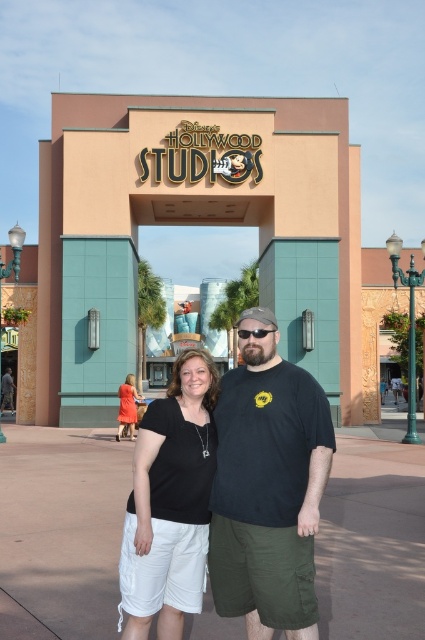
Question: In this image, where is beige concrete entrance at center located relative to matte orange dress at lower left?

Choices:
 (A) left
 (B) right

Answer: (B)

Question: Which point is farther to the camera?

Choices:
 (A) coord(299,468)
 (B) coord(136,509)

Answer: (A)

Question: Which of the following is the farthest from the observer?

Choices:
 (A) (198, 380)
 (B) (122, 390)

Answer: (B)

Question: Can you confirm if black cotton shirt at center is smaller than matte orange dress at lower left?

Choices:
 (A) no
 (B) yes

Answer: (A)

Question: Among these points, which one is nearest to the camera?

Choices:
 (A) (343, 145)
 (B) (180, 513)

Answer: (B)

Question: From the image, what is the correct spatial relationship of beige concrete entrance at center in relation to black cotton t-shirt at center?

Choices:
 (A) right
 (B) left

Answer: (A)